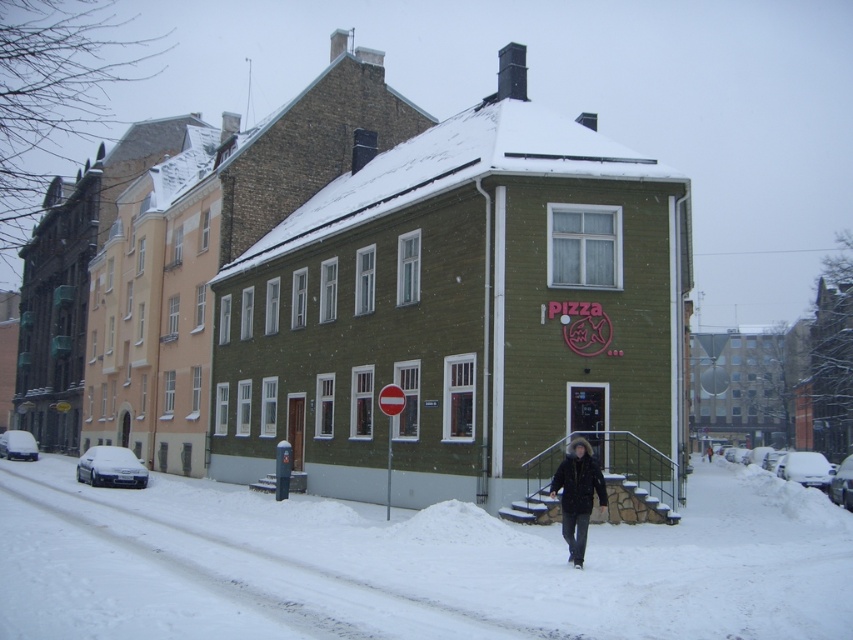
Who is taller, white powdery snow at center or black glossy car at lower right?

Standing taller between the two is black glossy car at lower right.

Locate an element on the screen. white powdery snow at center is located at coordinates (410, 564).

Who is more distant from viewer, (564, 509) or (99, 461)?

The point (99, 461) is behind.

Between dark brown fur-lined coat at lower center and white matte car at lower left, which one appears on the right side from the viewer's perspective?

From the viewer's perspective, dark brown fur-lined coat at lower center appears more on the right side.

This screenshot has height=640, width=853. Describe the element at coordinates (577, 493) in the screenshot. I see `dark brown fur-lined coat at lower center` at that location.

Where is `dark brown fur-lined coat at lower center`? dark brown fur-lined coat at lower center is located at coordinates [x=577, y=493].

In the scene shown: Is white matte car at lower left below white matte car at left?

No, white matte car at lower left is not below white matte car at left.

Is point (90, 456) more distant than point (12, 436)?

No, it is not.

From the picture: Who is more distant from viewer, (140, 483) or (32, 460)?

Point (32, 460)

At what (x,y) coordinates should I click in order to perform the action: click on white matte car at lower left. Please return your answer as a coordinate pair (x, y). Looking at the image, I should click on (111, 467).